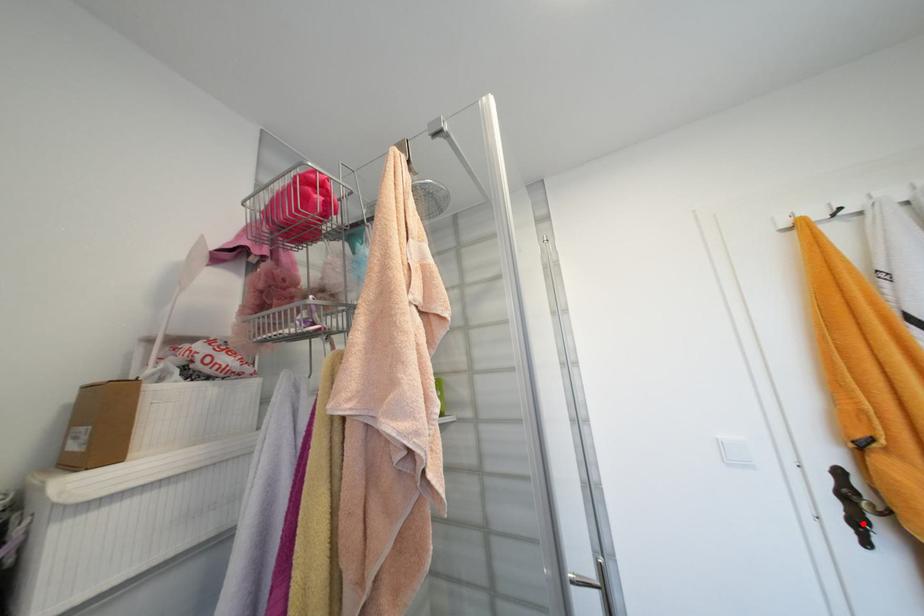
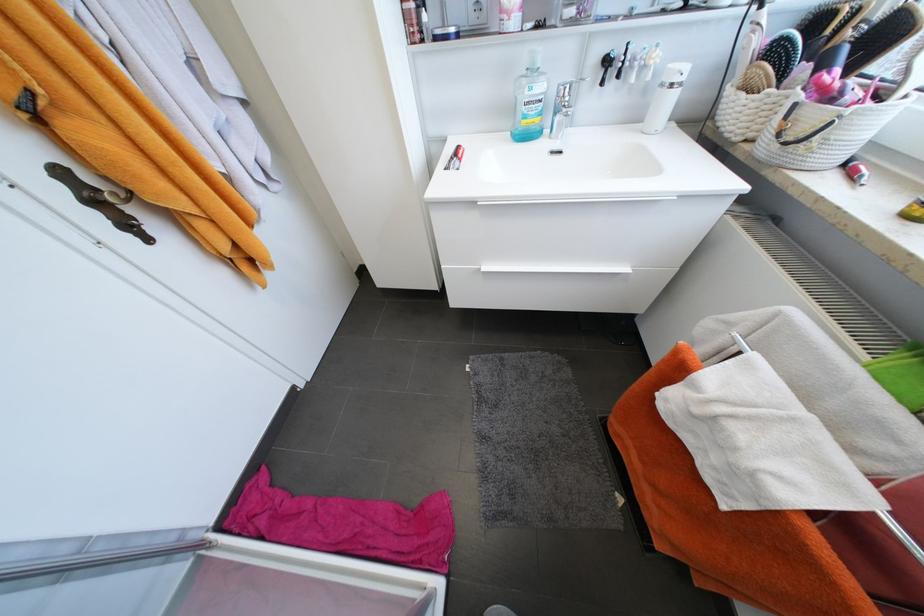
Question: I am providing you with two images of the same scene from different viewpoints. Image1 has a red point marked. In image2, the corresponding 3D location appears at what relative position? Reply with the corresponding letter.

Choices:
 (A) Closer
 (B) Farther

Answer: (B)